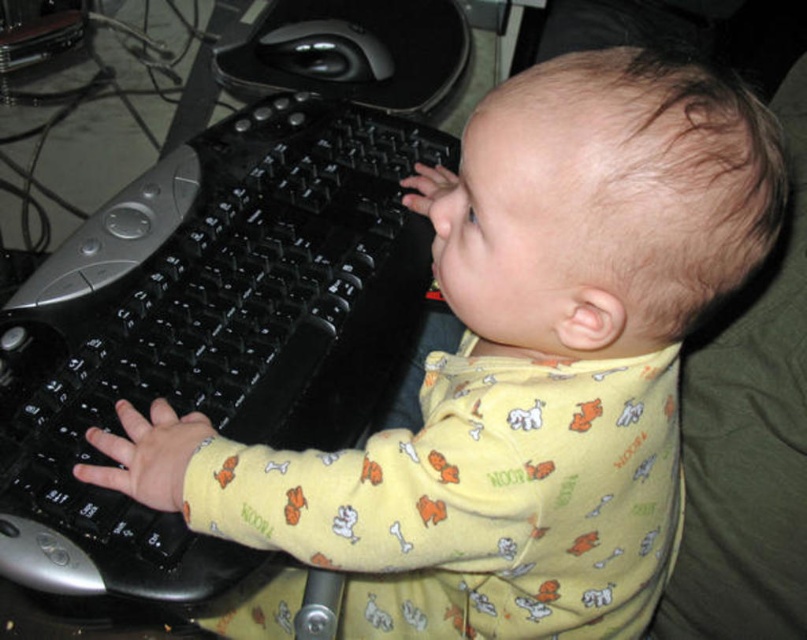
Looking at this image, you are a photographer taking a picture of the baby in the scene. The baby is wearing a light yellow long sleeved shirt with orange and white animal prints. The baby has their left hand on the black plastic keyboard at left. To ensure the keyboard is fully visible in the photo, where should you position the camera relative to the baby?

The black plastic keyboard at left is located at point 2D coordinates of (210, 330). To ensure the keyboard is fully visible, the camera should be positioned so that it captures the area around those coordinates, likely centered or slightly to the left side of the baby where the keyboard is placed.

You are a parent trying to set up a workstation for your baby. The baby is currently looking at the black plastic keyboard at left and the black glossy mouse at upper center. Which object is positioned higher on the screen?

The black glossy mouse at upper center is positioned higher on the screen than the black plastic keyboard at left.

You are setting up a workstation for a child. You have a black plastic keyboard at left and a black glossy mouse at upper center. Considering their sizes, which object would you place closer to the edge of the desk to save space?

The black glossy mouse at upper center is smaller in width compared to the black plastic keyboard at left, so placing the black glossy mouse at upper center closer to the edge of the desk would save more space.